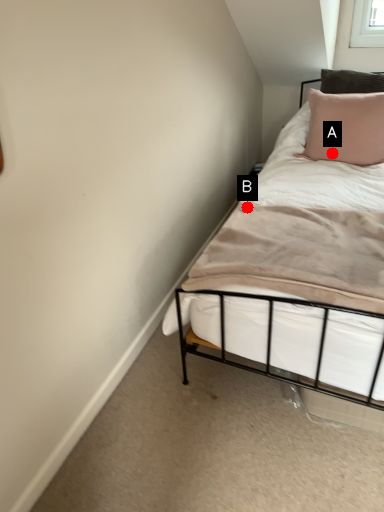
Question: Two points are circled on the image, labeled by A and B beside each circle. Which of the following is the closest to the observer?

Choices:
 (A) A is closer
 (B) B is closer

Answer: (B)